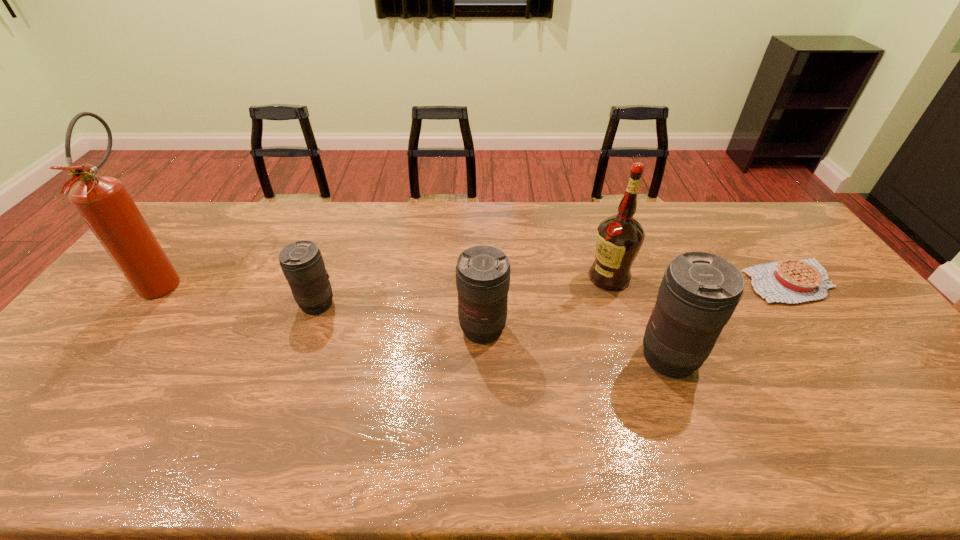
Locate an element on the screen. vacant region located on the label of the second tallest object is located at coordinates (505, 278).

Locate an element on the screen. vacant space located on the label of the second tallest object is located at coordinates (560, 278).

This screenshot has height=540, width=960. Identify the location of vacant space located 0.370m on the front of the rightmost object. (894, 422).

You are a GUI agent. You are given a task and a screenshot of the screen. Output one action in this format:
    pyautogui.click(x=<x>, y=<y>)
    Task: Click on the object located at the left edge
    Image resolution: width=960 pixels, height=540 pixels.
    Given the screenshot: What is the action you would take?
    pyautogui.click(x=103, y=202)

The height and width of the screenshot is (540, 960). Find the location of `object that is at the right edge`. object that is at the right edge is located at coordinates (787, 281).

This screenshot has height=540, width=960. I want to click on vacant region at the far edge of the desktop, so click(490, 213).

Identify the location of free space at the near edge. This screenshot has height=540, width=960. (857, 399).

Identify the location of free region at the right edge. (846, 343).

Identify the location of vacant space at the far left corner. (168, 237).

What are the coordinates of `free space between the tallest object and the fifth object from right to left` in the screenshot? It's located at (241, 292).